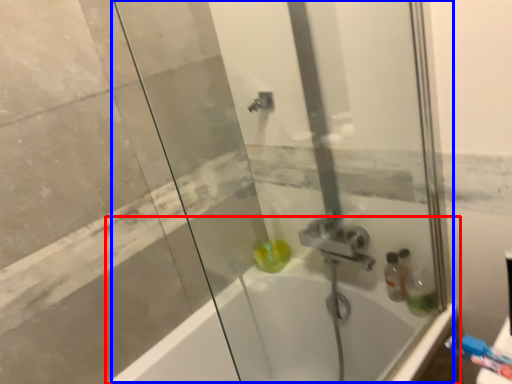
Question: Among these objects, which one is farthest to the camera, bathtub (highlighted by a red box) or shower door (highlighted by a blue box)?

Choices:
 (A) bathtub
 (B) shower door

Answer: (A)